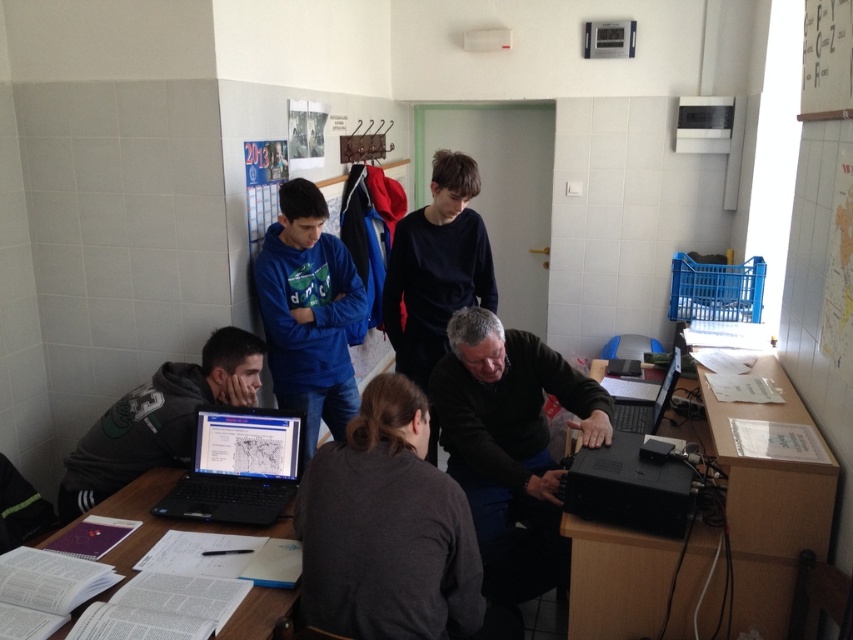
Who is lower down, black plastic table at right or black matte shirt at center?

black plastic table at right is lower down.

Who is taller, black plastic table at right or black matte shirt at center?

Standing taller between the two is black matte shirt at center.

Describe the element at coordinates (764, 500) in the screenshot. I see `black plastic table at right` at that location.

Identify the location of black plastic table at right. (764, 500).

Who is lower down, dark gray sweater at lower center or white paper at lower left?

Positioned lower is white paper at lower left.

Can you confirm if dark gray sweater at lower center is positioned above white paper at lower left?

Correct, dark gray sweater at lower center is located above white paper at lower left.

Does point (395, 467) come closer to viewer compared to point (263, 589)?

Yes, it is in front of point (263, 589).

The height and width of the screenshot is (640, 853). Find the location of `dark gray sweater at lower center`. dark gray sweater at lower center is located at coordinates (386, 529).

Who is shorter, blue fleece jacket at center or white paper at lower left?

white paper at lower left

Can you confirm if blue fleece jacket at center is positioned to the left of white paper at lower left?

In fact, blue fleece jacket at center is to the right of white paper at lower left.

Which is in front, point (257, 288) or point (169, 488)?

Point (169, 488)

This screenshot has width=853, height=640. I want to click on blue fleece jacket at center, so tap(308, 312).